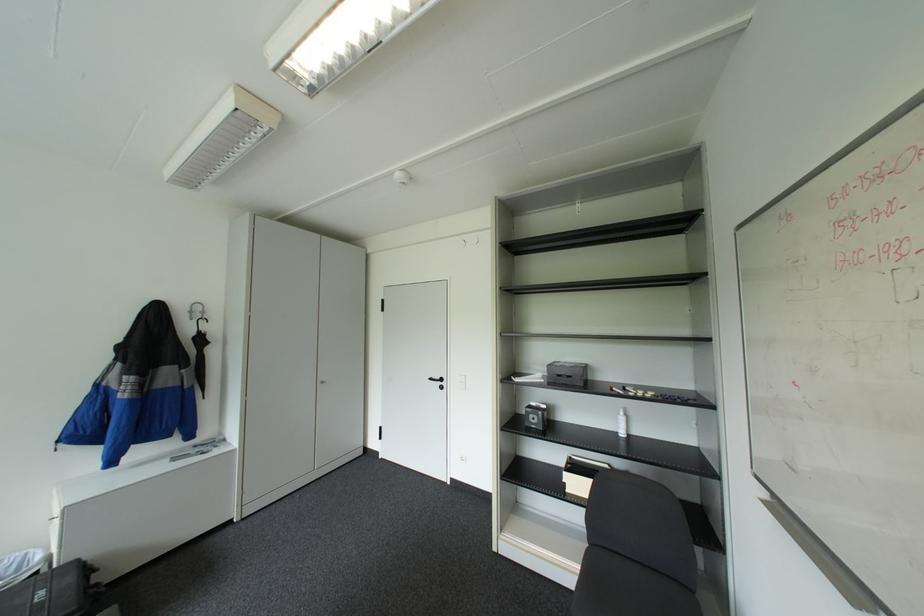
This screenshot has width=924, height=616. I want to click on black door handle, so click(438, 381).